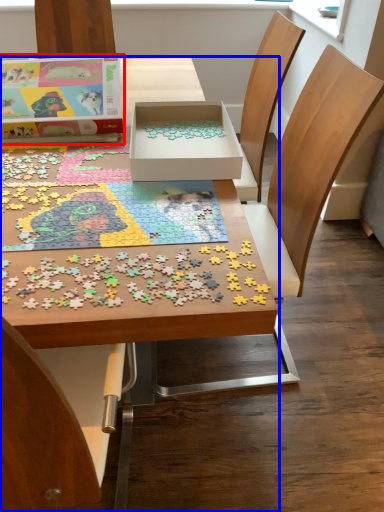
Question: Which point is further to the camera, box (highlighted by a red box) or table (highlighted by a blue box)?

Choices:
 (A) box
 (B) table

Answer: (A)